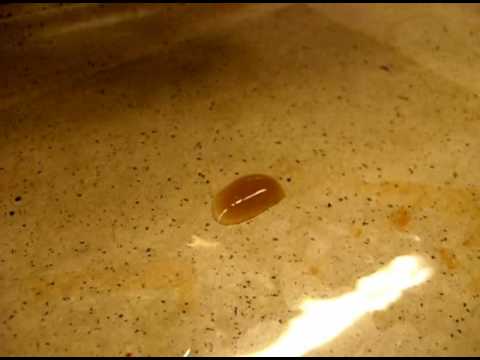
Identify the location of lip of countertop. This screenshot has width=480, height=360. (41, 18).